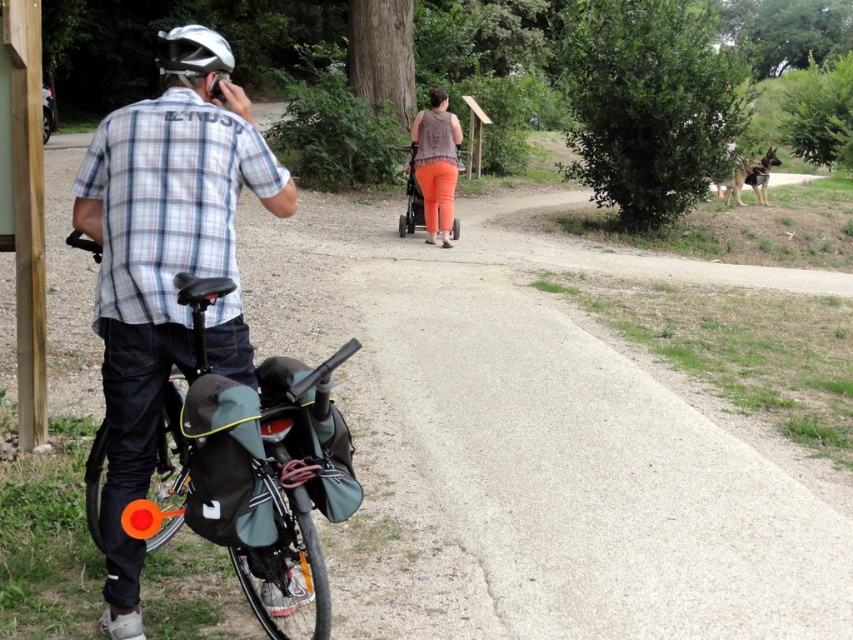
You are standing at the camera position and want to hand a small object to the person wearing the orange cotton pants at center. Can you throw it directly without needing to walk closer?

The orange cotton pants at center and camera are 12.46 meters apart. Throwing a small object that distance is possible but may be difficult due to the distance. However, the question specifies whether it can be done without walking closer, so technically yes, it is possible to attempt the throw.

You are a photographer trying to capture the silver metallic helmet at upper left in the image. Where exactly should you focus your camera to ensure it is centered in your shot?

You should focus your camera at point coordinates of (193,52) to center the silver metallic helmet at upper left.

You are standing at the point with coordinates (193, 52). What object are you standing on?

The point with coordinates (193, 52) is on the silver metallic helmet at upper left.